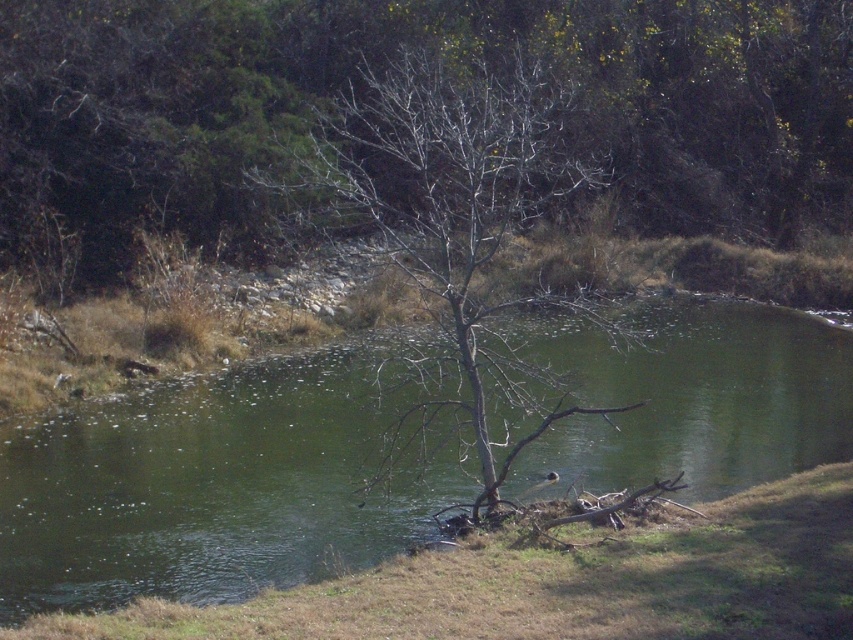
You are a photographer standing at the edge of the pond. You want to take a closeup photo of the bare branches at center. Given that your camera has a maximum zoom range of 25 meters, can you capture the branches without moving closer?

The bare branches at center is 26.17 meters from camera. Since the maximum zoom is 25 meters, you cannot capture the branches without moving closer.

You are a bird looking for a place to land. You see the bare branches at center and the green water at center. Which location is taller for you to perch on?

The bare branches at center are taller than the green water at center, so you should choose the bare branches at center to perch on.

You are a gardener who wants to plant a new shrub between the green water at center and the bare wood tree at center. The shrub requires a space of 10 feet between the water and the tree to grow properly. Can you plant the shrub there?

The distance between the green water at center and the bare wood tree at center is 12.06 feet, which is more than the required 10 feet. Therefore, you can plant the shrub there.